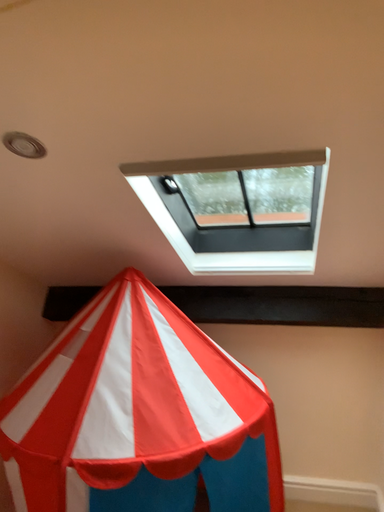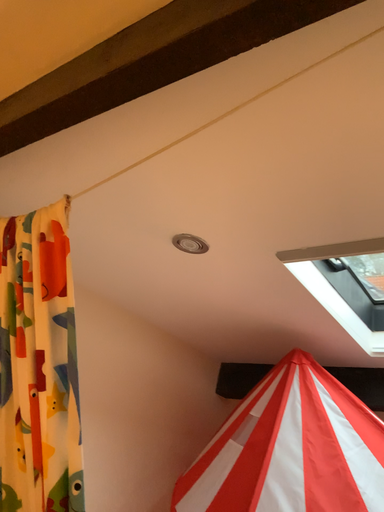
Question: Which way did the camera rotate in the video?

Choices:
 (A) rotated downward
 (B) rotated upward

Answer: (B)